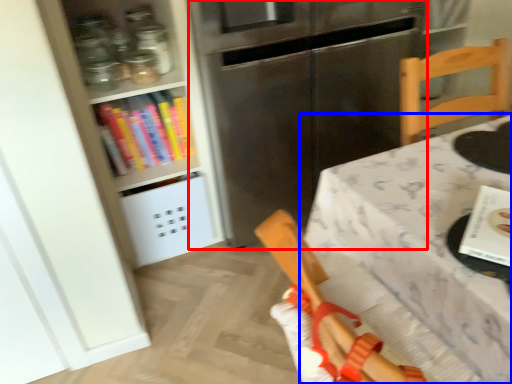
Question: Among these objects, which one is nearest to the camera, fridge (highlighted by a red box) or table (highlighted by a blue box)?

Choices:
 (A) fridge
 (B) table

Answer: (B)